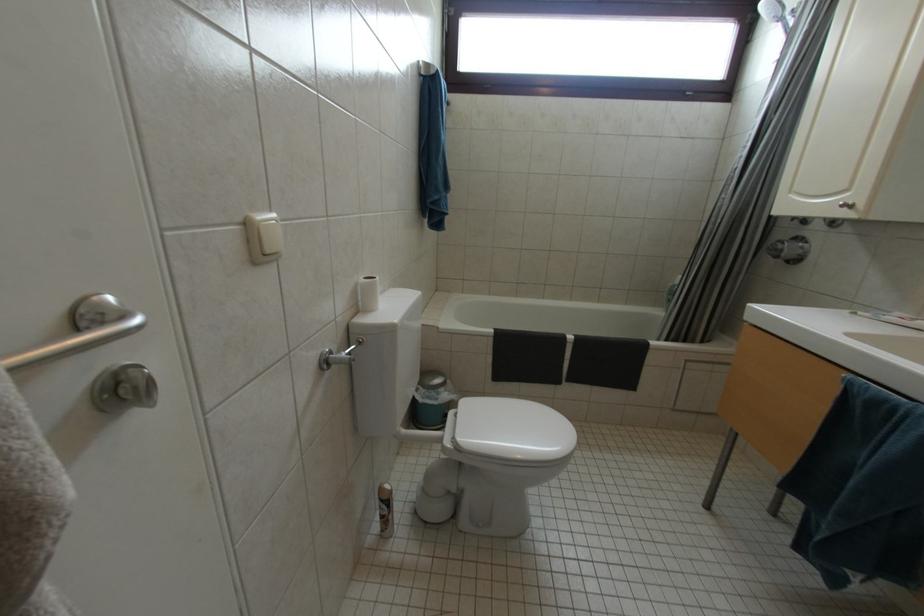
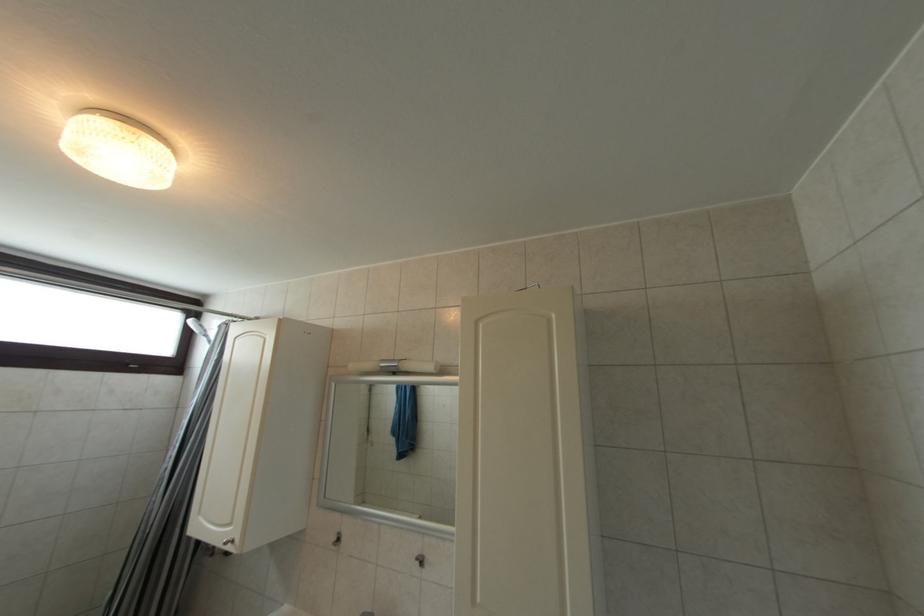
Based on the continuous images, in which direction is the camera rotating?

The camera rotated toward right-up.